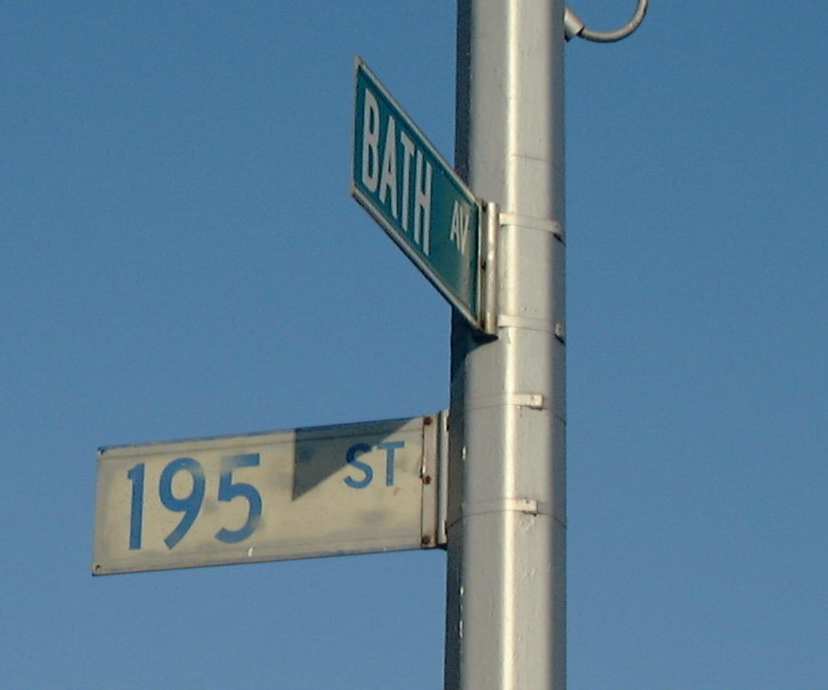
The image size is (828, 690). Identify the location of bath in white font. (397, 179).